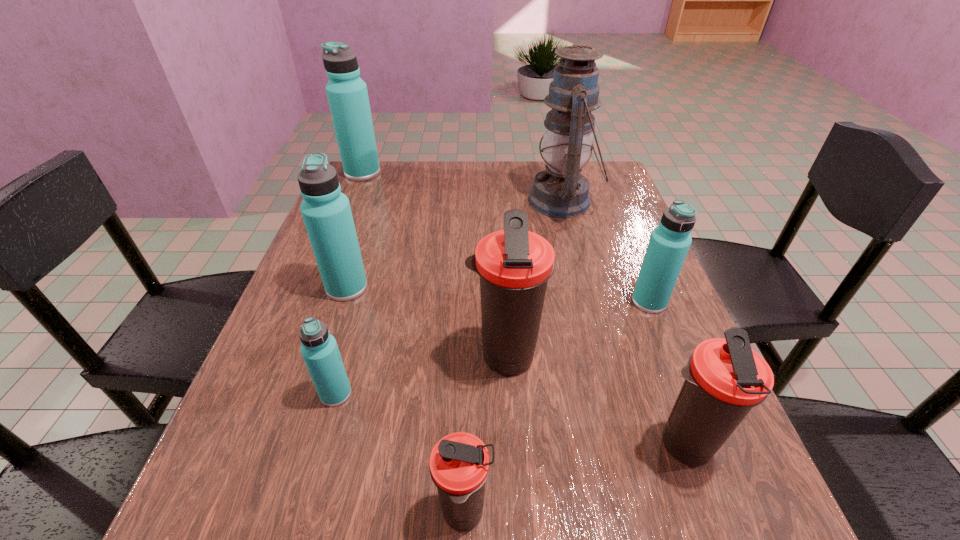
Identify the location of object at the far right corner. (560, 191).

I want to click on vacant position at the far edge of the desktop, so click(x=459, y=166).

Identify the location of vacant point at the near edge. The width and height of the screenshot is (960, 540). (350, 496).

Identify the location of vacant region at the left edge of the desktop. pos(361,235).

The height and width of the screenshot is (540, 960). I want to click on free space at the right edge, so click(662, 341).

You are a GUI agent. You are given a task and a screenshot of the screen. Output one action in this format:
    pyautogui.click(x=<x>, y=<y>)
    Task: Click on the free space at the near left corner of the desktop
    The image size is (960, 540).
    Given the screenshot: What is the action you would take?
    pyautogui.click(x=233, y=526)

You are a GUI agent. You are given a task and a screenshot of the screen. Output one action in this format:
    pyautogui.click(x=<x>, y=<y>)
    Task: Click on the vacant area between the second smallest brown thermos bottle and the oil lamp
    This screenshot has height=540, width=960.
    Given the screenshot: What is the action you would take?
    pyautogui.click(x=623, y=323)

In order to click on vacant area that lies between the third smallest aqua thermos bottle and the smallest aqua thermos bottle in this screenshot , I will do `click(342, 341)`.

Locate an element on the screen. Image resolution: width=960 pixels, height=540 pixels. free space between the rightmost brown thermos bottle and the oil lamp is located at coordinates (623, 323).

Where is `unoccupied area between the third smallest aqua thermos bottle and the nearest aqua thermos bottle`? The image size is (960, 540). unoccupied area between the third smallest aqua thermos bottle and the nearest aqua thermos bottle is located at coordinates (342, 341).